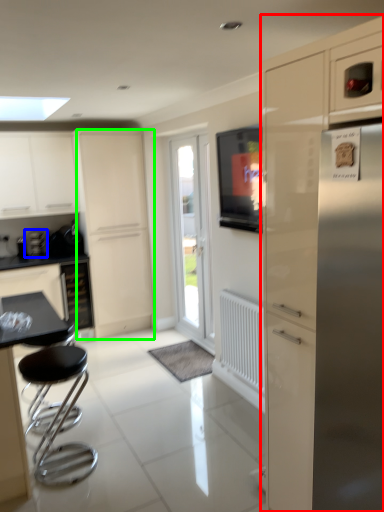
Question: Which is nearer to the cabinetry (highlighted by a red box)? coffee machine (highlighted by a blue box) or screen door (highlighted by a green box).

Choices:
 (A) coffee machine
 (B) screen door

Answer: (B)